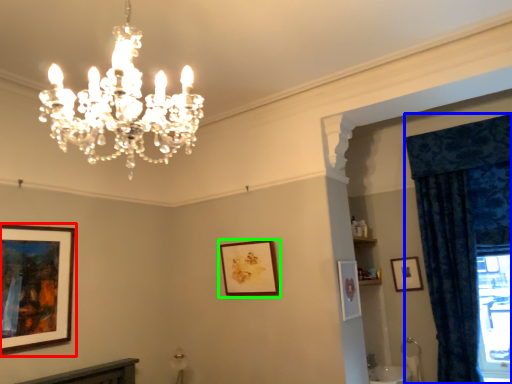
Question: Considering the real-world distances, which object is farthest from picture frame (highlighted by a red box)? curtain (highlighted by a blue box) or picture frame (highlighted by a green box)?

Choices:
 (A) curtain
 (B) picture frame

Answer: (A)